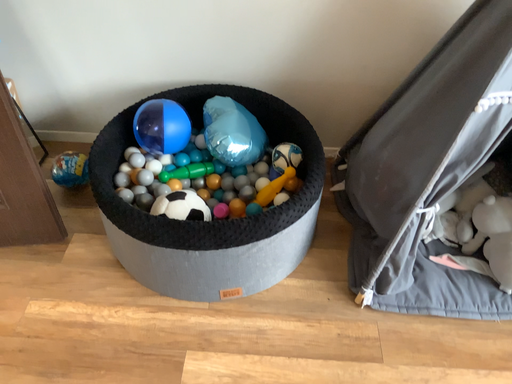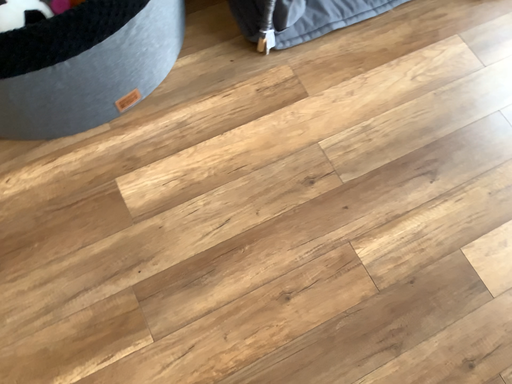
Question: How did the camera likely rotate when shooting the video?

Choices:
 (A) rotated right
 (B) rotated left

Answer: (A)